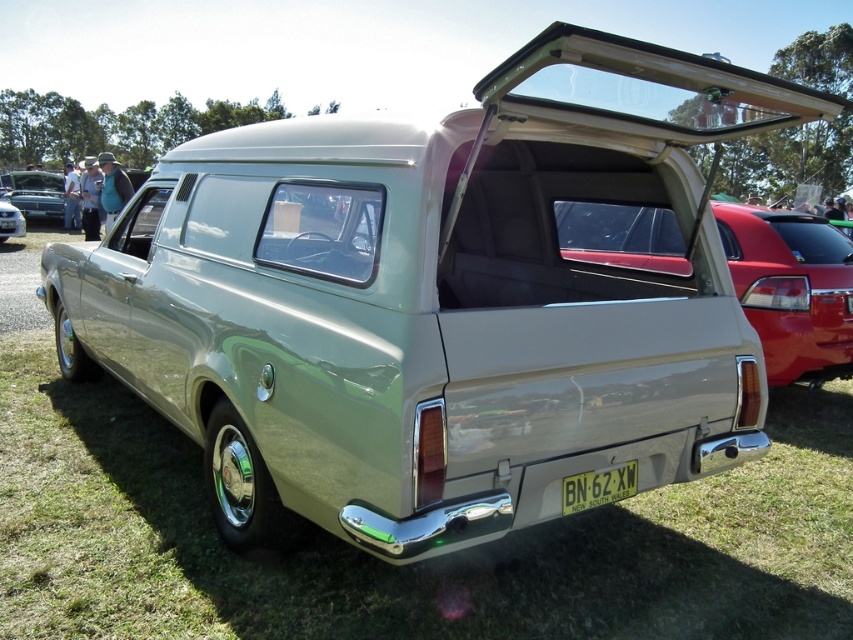
You are a delivery person trying to attach a package to the green glossy car at center. The package is too big to fit on the roof, so you need to place it somewhere else. Considering the size of the white plastic license plate at center, can you determine if the package will fit in the area near the license plate?

The green glossy car at center is larger than the white plastic license plate at center, so the area near the license plate might be too small to accommodate the package. Consider placing it elsewhere on the car where there is more space.

You are planning to park your car in a parking spot that can only accommodate vehicles up to the size of the shiny black car at left. There is a satin silver panel van at center already parked there. Is the parking spot available for your car?

The shiny black car at left has a smaller size compared to the satin silver panel van at center. Since the parking spot can only accommodate vehicles up to the size of the shiny black car at left, the satin silver panel van at center is too large to fit, so the parking spot is available for your car if it is the size of the shiny black car at left or smaller.